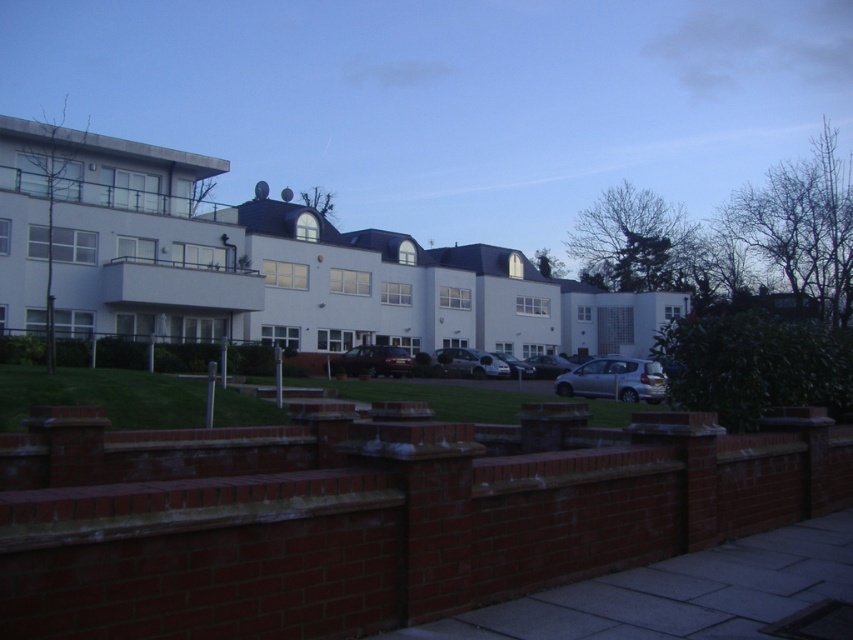
You are a delivery person trying to park your vehicle in the residential complex. You see a satin black car at center and a shiny silver car at center. Which car is blocking the parking spot?

The satin black car at center is positioned over the shiny silver car at center, so the satin black car is blocking the parking spot.